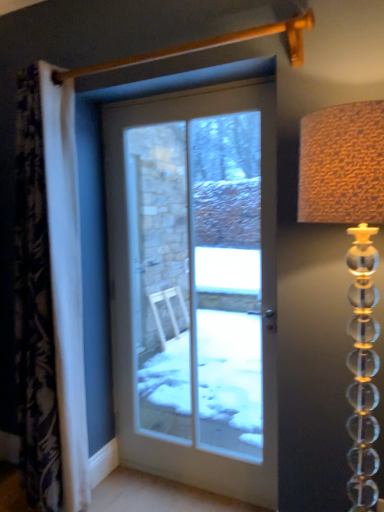
Question: Should I look upward or downward to see white fabric curtain at left?

Choices:
 (A) up
 (B) down

Answer: (B)

Question: Is white fabric curtain at left facing towards translucent glass lampshade at right?

Choices:
 (A) yes
 (B) no

Answer: (B)

Question: Is the position of white fabric curtain at left more distant than that of translucent glass lampshade at right?

Choices:
 (A) no
 (B) yes

Answer: (B)

Question: Can you confirm if white fabric curtain at left is wider than translucent glass lampshade at right?

Choices:
 (A) no
 (B) yes

Answer: (A)

Question: Does white fabric curtain at left have a lesser width compared to translucent glass lampshade at right?

Choices:
 (A) yes
 (B) no

Answer: (A)

Question: Can you confirm if white fabric curtain at left is bigger than translucent glass lampshade at right?

Choices:
 (A) no
 (B) yes

Answer: (B)

Question: Is white fabric curtain at left at the right side of translucent glass lampshade at right?

Choices:
 (A) yes
 (B) no

Answer: (B)

Question: From a real-world perspective, is translucent glass lampshade at right located higher than white fabric curtain at left?

Choices:
 (A) no
 (B) yes

Answer: (A)

Question: Could you tell me if translucent glass lampshade at right is turned towards white fabric curtain at left?

Choices:
 (A) yes
 (B) no

Answer: (B)

Question: Is translucent glass lampshade at right outside of white fabric curtain at left?

Choices:
 (A) no
 (B) yes

Answer: (B)

Question: Considering the relative positions of translucent glass lampshade at right and white fabric curtain at left in the image provided, is translucent glass lampshade at right to the right of white fabric curtain at left from the viewer's perspective?

Choices:
 (A) no
 (B) yes

Answer: (B)

Question: Is translucent glass lampshade at right not close to white fabric curtain at left?

Choices:
 (A) yes
 (B) no

Answer: (A)

Question: From the image's perspective, would you say translucent glass lampshade at right is shown under white fabric curtain at left?

Choices:
 (A) yes
 (B) no

Answer: (A)

Question: Would you say white glass door at center is outside translucent glass lampshade at right?

Choices:
 (A) yes
 (B) no

Answer: (A)